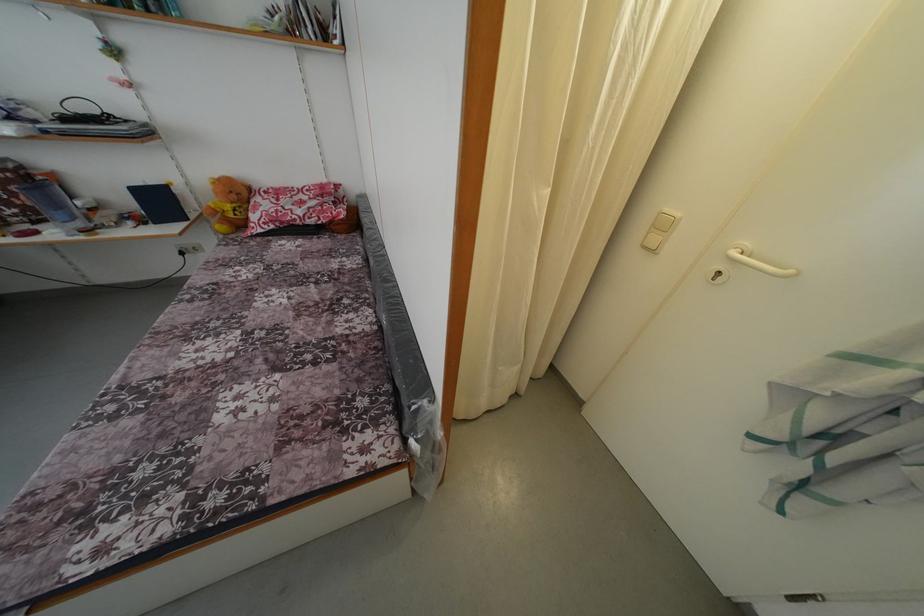
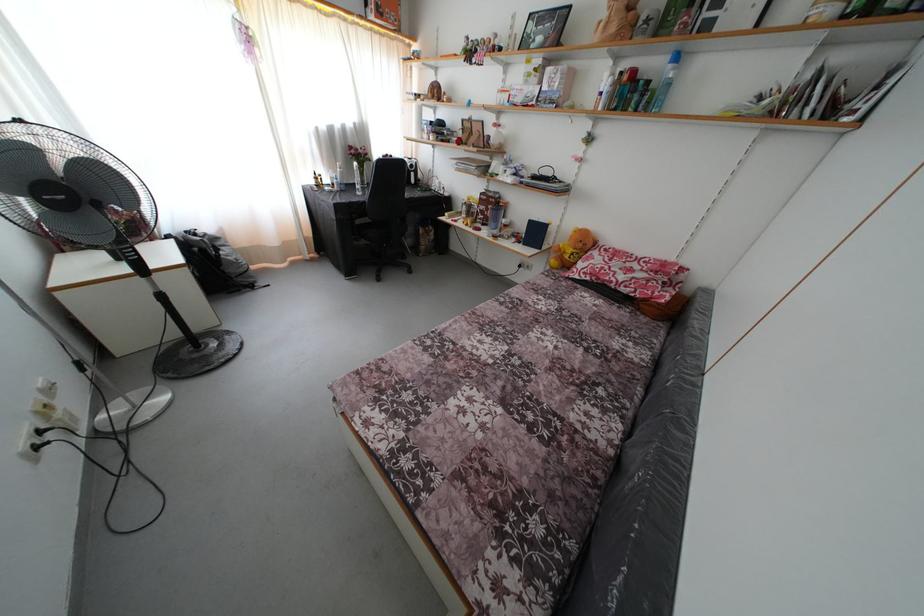
In the second image, find the point that corresponds to point (188, 259) in the first image.

(525, 272)